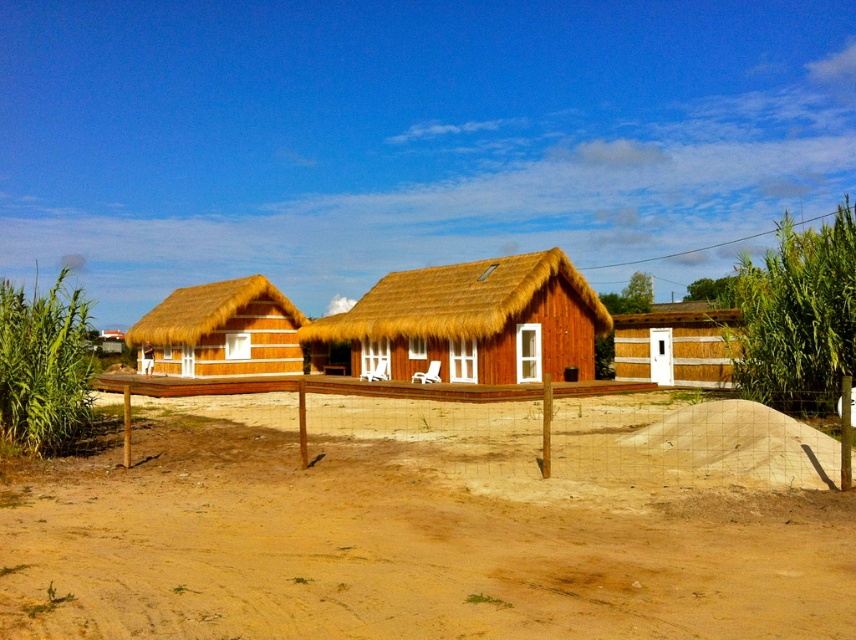
Question: Which point is farther from the camera taking this photo?

Choices:
 (A) (175, 634)
 (B) (666, 417)
 (C) (616, 339)

Answer: (C)

Question: Is wooden hut at center closer to camera compared to wooden thatched hut at left?

Choices:
 (A) yes
 (B) no

Answer: (A)

Question: Estimate the real-world distances between objects in this image. Which object is closer to the brown sandy dirt field at lower center?

Choices:
 (A) wooden fence at center
 (B) wooden hut at center

Answer: (A)

Question: Can you confirm if brown sandy dirt field at lower center is bigger than wooden thatched hut at left?

Choices:
 (A) no
 (B) yes

Answer: (B)

Question: Estimate the real-world distances between objects in this image. Which object is farther from the wooden hut at center?

Choices:
 (A) wooden thatched hut at left
 (B) white wooden hut at center
 (C) brown sandy dirt field at lower center
 (D) wooden fence at center

Answer: (C)

Question: Does wooden hut at center come in front of white wooden hut at center?

Choices:
 (A) no
 (B) yes

Answer: (A)